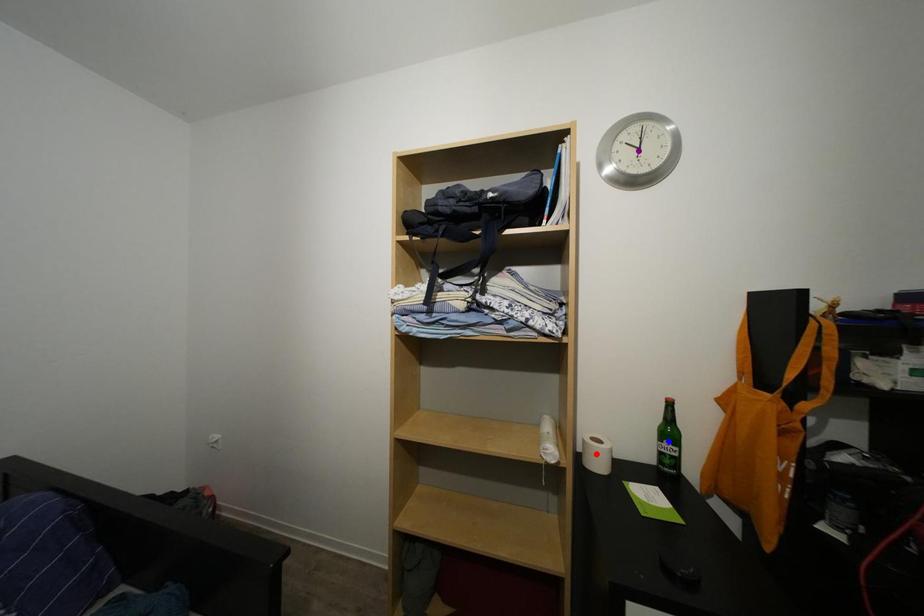
Order these from nearest to farthest:
red point | blue point | purple point

blue point → purple point → red point